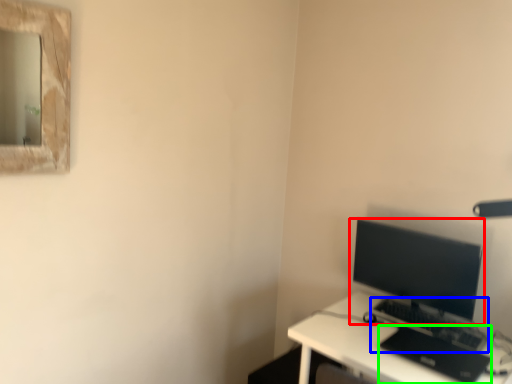
Question: Estimate the real-world distances between objects in this image. Which object is closer to computer monitor (highlighted by a red box), computer keyboard (highlighted by a blue box) or laptop (highlighted by a green box)?

Choices:
 (A) computer keyboard
 (B) laptop

Answer: (A)